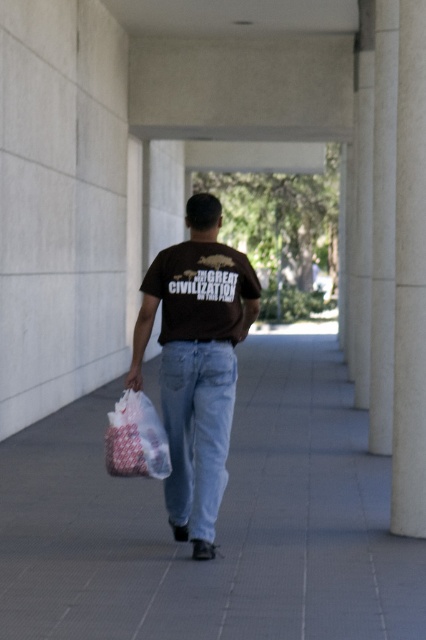
Can you confirm if gray concrete pavement at center is wider than brown cotton t-shirt at center?

Correct, the width of gray concrete pavement at center exceeds that of brown cotton t-shirt at center.

Does gray concrete pavement at center lie behind brown cotton t-shirt at center?

No, it is not.

Is point (103, 472) positioned after point (238, 323)?

Yes.

The image size is (426, 640). In order to click on gray concrete pavement at center in this screenshot , I will do `click(216, 522)`.

Which is in front, point (403, 282) or point (224, 264)?

Point (224, 264) is more forward.

Between white smooth pillar at right and brown cotton t-shirt at center, which one is positioned lower?

brown cotton t-shirt at center

Is point (414, 314) more distant than point (232, 291)?

That is True.

The image size is (426, 640). In order to click on white smooth pillar at right in this screenshot , I will do `click(409, 278)`.

Does white smooth pillar at right have a greater height compared to denim at center?

Correct, white smooth pillar at right is much taller as denim at center.

Does white smooth pillar at right have a lesser width compared to denim at center?

Yes.

Image resolution: width=426 pixels, height=640 pixels. What do you see at coordinates (409, 278) in the screenshot?
I see `white smooth pillar at right` at bounding box center [409, 278].

Identify the location of white smooth pillar at right. (409, 278).